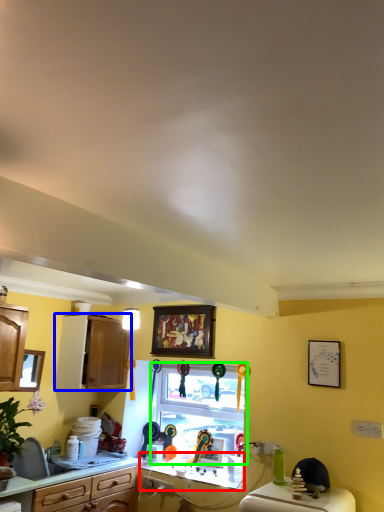
Question: Which object is the farthest from counter top (highlighted by a red box)? Choose among these: cabinetry (highlighted by a blue box) or window (highlighted by a green box).

Choices:
 (A) cabinetry
 (B) window

Answer: (A)